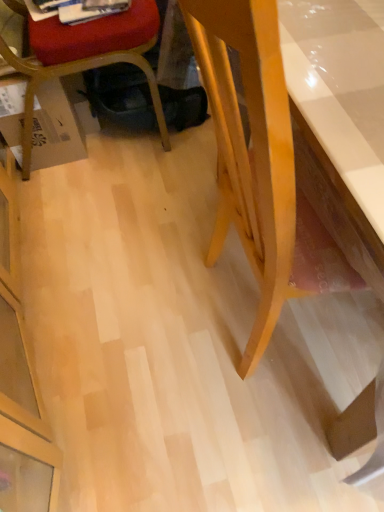
Question: From a real-world perspective, is matte plastic chair at lower left physically above light wood desk at right?

Choices:
 (A) yes
 (B) no

Answer: (B)

Question: Can light wood desk at right be found inside matte plastic chair at lower left?

Choices:
 (A) yes
 (B) no

Answer: (B)

Question: Is matte plastic chair at lower left not inside light wood desk at right?

Choices:
 (A) no
 (B) yes

Answer: (B)

Question: Is matte plastic chair at lower left wider than light wood desk at right?

Choices:
 (A) no
 (B) yes

Answer: (A)

Question: Can you confirm if matte plastic chair at lower left is positioned to the right of light wood desk at right?

Choices:
 (A) no
 (B) yes

Answer: (A)

Question: Does matte plastic chair at lower left have a lesser width compared to light wood desk at right?

Choices:
 (A) yes
 (B) no

Answer: (A)

Question: Is light wood desk at right in front of matte plastic chair at lower left?

Choices:
 (A) no
 (B) yes

Answer: (B)

Question: Is light wood desk at right at the left side of matte plastic chair at lower left?

Choices:
 (A) no
 (B) yes

Answer: (A)

Question: From the image's perspective, is light wood desk at right above matte plastic chair at lower left?

Choices:
 (A) no
 (B) yes

Answer: (A)

Question: Can we say light wood desk at right lies outside matte plastic chair at lower left?

Choices:
 (A) yes
 (B) no

Answer: (A)

Question: From a real-world perspective, is light wood desk at right positioned over matte plastic chair at lower left based on gravity?

Choices:
 (A) yes
 (B) no

Answer: (A)

Question: From a real-world perspective, does light wood desk at right sit lower than matte plastic chair at lower left?

Choices:
 (A) yes
 (B) no

Answer: (B)

Question: Can you confirm if white glossy magazine at upper left is positioned to the right of light wood desk at right?

Choices:
 (A) no
 (B) yes

Answer: (A)